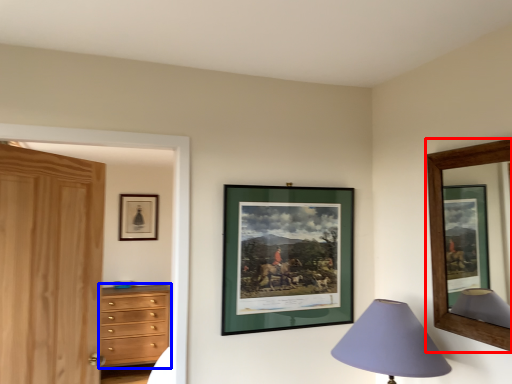
Question: Among these objects, which one is farthest to the camera, picture frame (highlighted by a red box) or chest of drawers (highlighted by a blue box)?

Choices:
 (A) picture frame
 (B) chest of drawers

Answer: (B)